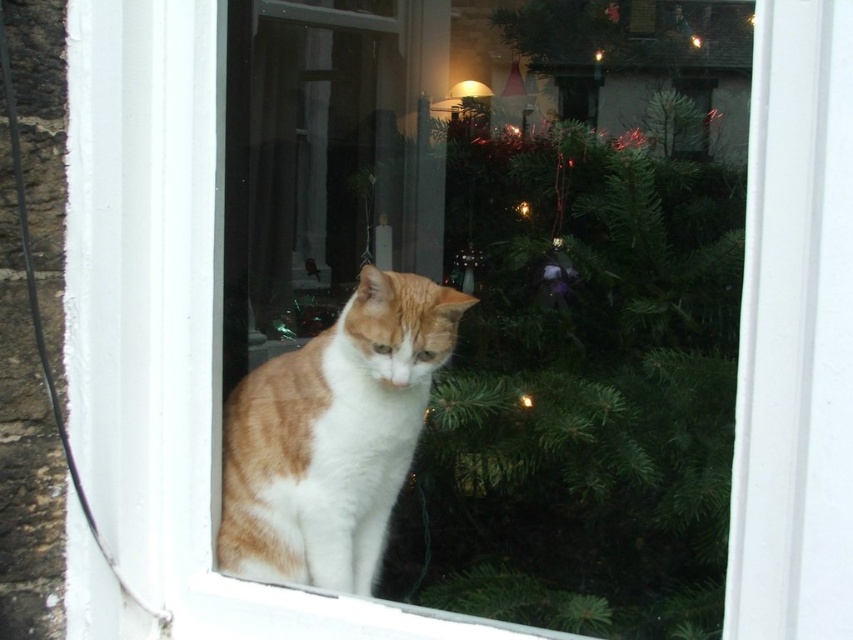
Question: Observing the image, what is the correct spatial positioning of green textured pine tree at center in reference to orange-white fur cat at center?

Choices:
 (A) left
 (B) right

Answer: (B)

Question: Which point is closer to the camera?

Choices:
 (A) green textured pine tree at center
 (B) orange-white fur cat at center

Answer: (B)

Question: Which point is farther to the camera?

Choices:
 (A) (323, 451)
 (B) (720, 371)

Answer: (B)

Question: From the image, what is the correct spatial relationship of green textured pine tree at center in relation to orange-white fur cat at center?

Choices:
 (A) left
 (B) right

Answer: (B)

Question: Is green textured pine tree at center positioned behind orange-white fur cat at center?

Choices:
 (A) yes
 (B) no

Answer: (A)